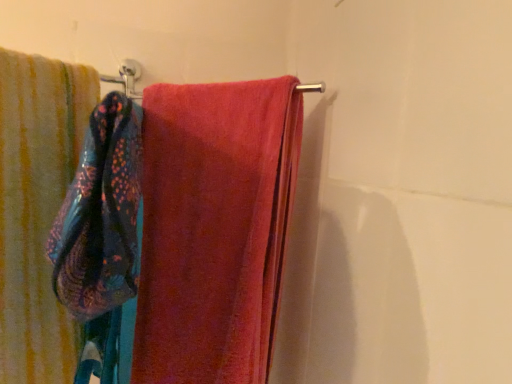
Question: Does point (247, 327) appear closer or farther from the camera than point (28, 64)?

Choices:
 (A) closer
 (B) farther

Answer: (A)

Question: From their relative heights in the image, would you say soft pink towel at center, which is counted as the 2th towel, starting from the left, is taller or shorter than soft cotton towel at left, which is the first towel from left to right?

Choices:
 (A) tall
 (B) short

Answer: (A)

Question: Estimate the real-world distances between objects in this image. Which object is farther from the blue textured towel at left?

Choices:
 (A) soft pink towel at center, which appears as the 1th towel when viewed from the right
 (B) soft cotton towel at left, which is the first towel from left to right

Answer: (A)

Question: Considering the real-world distances, which object is closest to the soft cotton towel at left, the 2th towel from the right?

Choices:
 (A) blue textured towel at left
 (B) soft pink towel at center, which appears as the 1th towel when viewed from the right

Answer: (A)